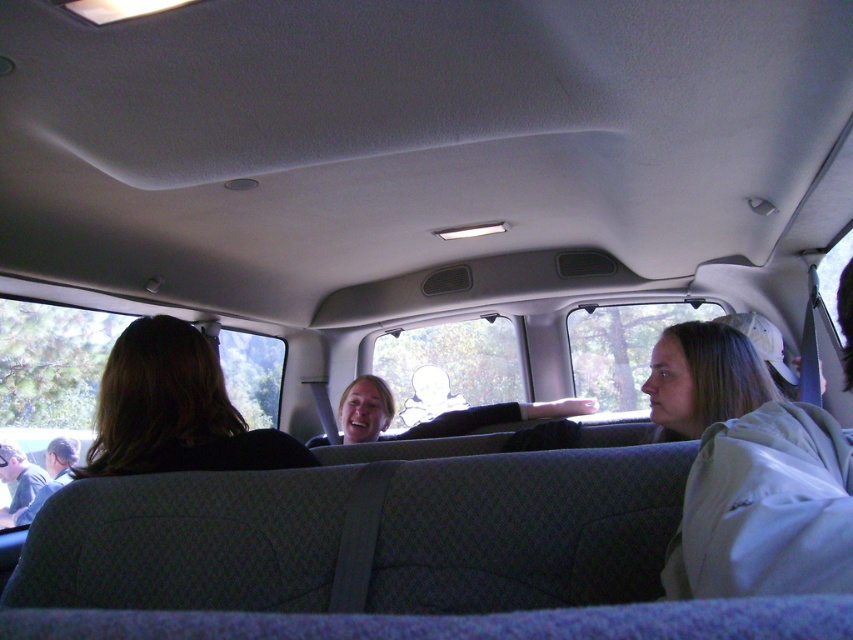
Question: Estimate the real-world distances between objects in this image. Which object is farther from the light brown leather jacket at lower left?

Choices:
 (A) dark brown hair at left
 (B) matte black shirt at center

Answer: (A)

Question: Which object is the closest to the dark gray shirt at lower left?

Choices:
 (A) dark brown hair at left
 (B) light brown leather jacket at lower left
 (C) matte black shirt at center

Answer: (B)

Question: Is dark brown hair at left wider than matte black shirt at center?

Choices:
 (A) no
 (B) yes

Answer: (A)

Question: Which point appears closest to the camera in this image?

Choices:
 (A) (35, 497)
 (B) (189, 442)
 (C) (350, 440)
 (D) (22, 483)

Answer: (B)

Question: Is matte black shirt at center below dark gray shirt at lower left?

Choices:
 (A) yes
 (B) no

Answer: (B)

Question: Can you confirm if matte black shirt at center is positioned below light brown leather jacket at lower left?

Choices:
 (A) yes
 (B) no

Answer: (B)